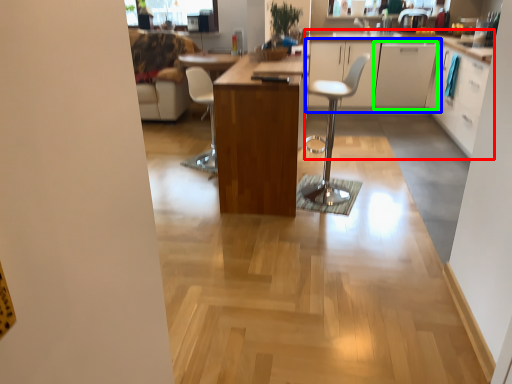
Question: Which object is positioned farthest from cabinetry (highlighted by a red box)? Select from cabinetry (highlighted by a blue box) and cabinetry (highlighted by a green box).

Choices:
 (A) cabinetry
 (B) cabinetry

Answer: (B)